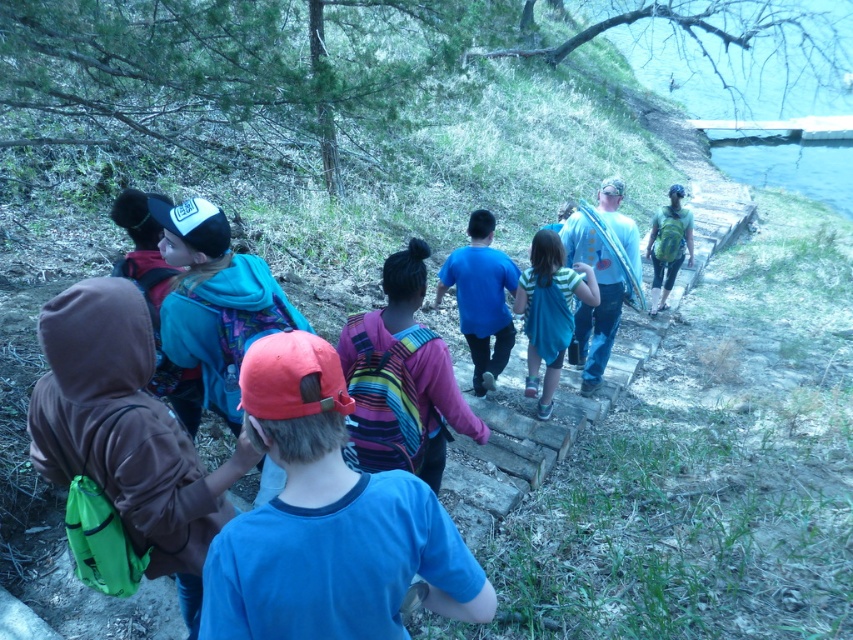
Question: From the image, what is the correct spatial relationship of blue t-shirt at center in relation to blue cotton shirt at center?

Choices:
 (A) left
 (B) right

Answer: (A)

Question: Considering the relative positions of camouflage-patterned shirt at center and blue cotton shirt at center in the image provided, where is camouflage-patterned shirt at center located with respect to blue cotton shirt at center?

Choices:
 (A) below
 (B) above

Answer: (B)

Question: Which of the following is the farthest from the observer?

Choices:
 (A) blue t-shirt at center
 (B) camouflage-patterned shirt at center
 (C) striped backpack at center

Answer: (B)

Question: Can you confirm if striped backpack at center is thinner than camouflage-patterned shirt at center?

Choices:
 (A) no
 (B) yes

Answer: (B)

Question: Which object is farther from the camera taking this photo?

Choices:
 (A) blue t-shirt at center
 (B) blue cotton shirt at center

Answer: (B)

Question: Which point is farther to the camera?

Choices:
 (A) camouflage-patterned shirt at center
 (B) green fabric backpack at right

Answer: (B)